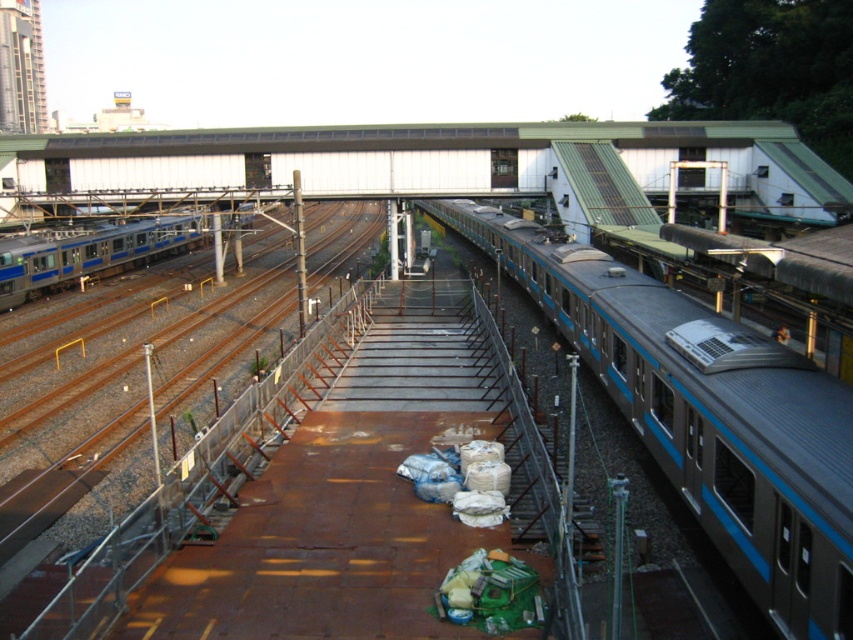
Question: Which point appears closest to the camera in this image?

Choices:
 (A) (691, 356)
 (B) (141, 324)

Answer: (A)

Question: In this image, where is brown metal train track at center located relative to silver metallic train at left?

Choices:
 (A) below
 (B) above

Answer: (B)

Question: Is brown metal train track at center positioned at the back of silver metallic train at left?

Choices:
 (A) no
 (B) yes

Answer: (A)

Question: Which point appears closest to the camera in this image?

Choices:
 (A) (770, 483)
 (B) (175, 236)
 (C) (241, 288)

Answer: (A)

Question: Does blue metallic train at center have a larger size compared to silver metallic train at left?

Choices:
 (A) yes
 (B) no

Answer: (B)

Question: Which object appears closest to the camera in this image?

Choices:
 (A) silver metallic train at left
 (B) brown metal train track at center
 (C) blue metallic train at center

Answer: (C)